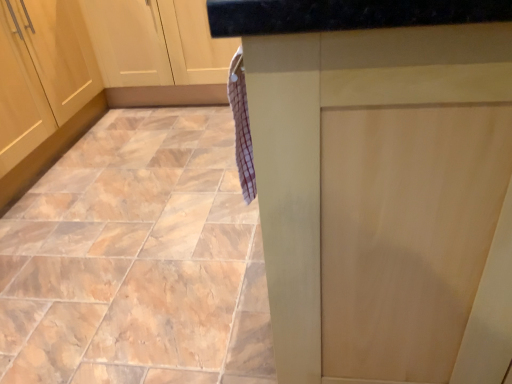
Question: Is matte wood counter at center located outside marble-like tile at lower left?

Choices:
 (A) no
 (B) yes

Answer: (B)

Question: Can you confirm if matte wood counter at center is thinner than marble-like tile at lower left?

Choices:
 (A) yes
 (B) no

Answer: (A)

Question: From a real-world perspective, is matte wood counter at center positioned over marble-like tile at lower left based on gravity?

Choices:
 (A) no
 (B) yes

Answer: (B)

Question: Could you tell me if matte wood counter at center is turned towards marble-like tile at lower left?

Choices:
 (A) no
 (B) yes

Answer: (A)

Question: Does matte wood counter at center have a smaller size compared to marble-like tile at lower left?

Choices:
 (A) yes
 (B) no

Answer: (B)

Question: Does matte wood counter at center have a larger size compared to marble-like tile at lower left?

Choices:
 (A) no
 (B) yes

Answer: (B)

Question: From the image's perspective, is marble-like tile at lower left located beneath matte wood counter at center?

Choices:
 (A) yes
 (B) no

Answer: (B)

Question: Is marble-like tile at lower left not near matte wood counter at center?

Choices:
 (A) no
 (B) yes

Answer: (A)

Question: Is the position of marble-like tile at lower left less distant than that of matte wood counter at center?

Choices:
 (A) no
 (B) yes

Answer: (A)

Question: Can you confirm if marble-like tile at lower left is positioned to the left of matte wood counter at center?

Choices:
 (A) no
 (B) yes

Answer: (B)

Question: Could you tell me if marble-like tile at lower left is turned towards matte wood counter at center?

Choices:
 (A) no
 (B) yes

Answer: (A)

Question: Considering the relative positions of marble-like tile at lower left and matte wood counter at center in the image provided, is marble-like tile at lower left to the right of matte wood counter at center from the viewer's perspective?

Choices:
 (A) no
 (B) yes

Answer: (A)

Question: Is marble-like tile at lower left in front of or behind matte wood counter at center in the image?

Choices:
 (A) front
 (B) behind

Answer: (B)